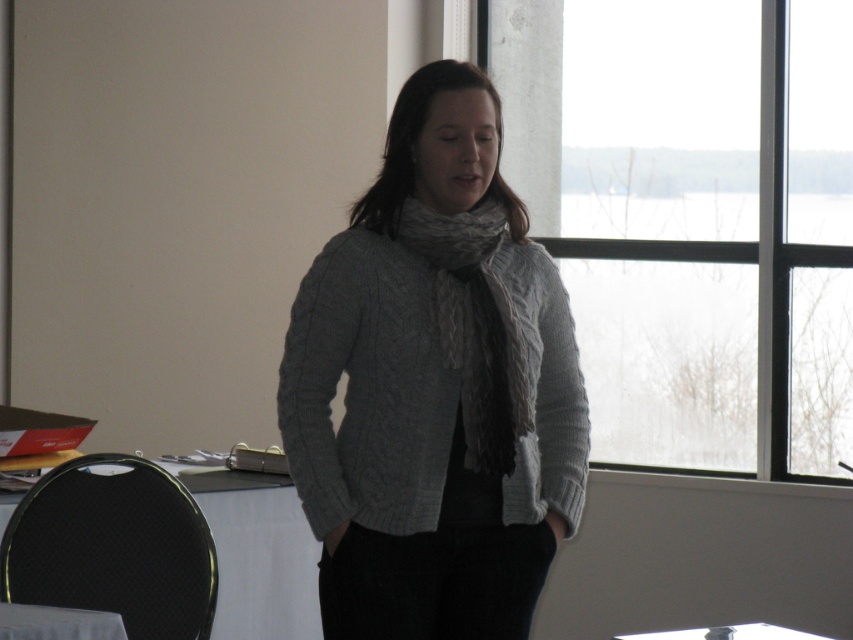
Question: Is knitted gray sweater at center bigger than white fabric table at lower left?

Choices:
 (A) no
 (B) yes

Answer: (B)

Question: Is gray knitted scarf at center above white fabric table at lower left?

Choices:
 (A) no
 (B) yes

Answer: (B)

Question: Which point is closer to the camera taking this photo?

Choices:
 (A) (120, 620)
 (B) (521, 211)
 (C) (416, 209)

Answer: (A)

Question: Estimate the real-world distances between objects in this image. Which object is closer to the knitted gray sweater at center?

Choices:
 (A) gray knitted scarf at center
 (B) transparent glass window at upper right

Answer: (A)

Question: Which point appears farthest from the camera in this image?

Choices:
 (A) (798, 340)
 (B) (270, 572)
 (C) (370, 448)

Answer: (A)

Question: From the image, what is the correct spatial relationship of transparent glass window at upper right in relation to gray knitted scarf at center?

Choices:
 (A) left
 (B) right

Answer: (B)